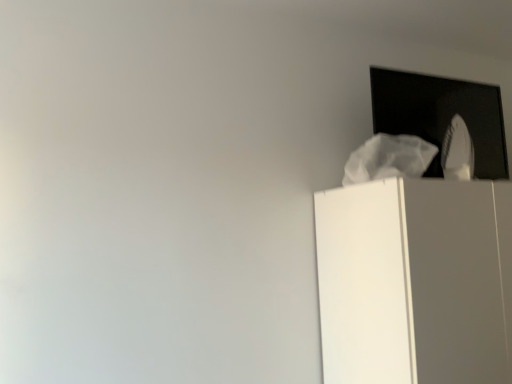
Question: Could you tell me if black glass window at upper right is turned towards white matte cabinet at upper right?

Choices:
 (A) no
 (B) yes

Answer: (A)

Question: Is black glass window at upper right smaller than white matte cabinet at upper right?

Choices:
 (A) yes
 (B) no

Answer: (A)

Question: Does black glass window at upper right have a lesser height compared to white matte cabinet at upper right?

Choices:
 (A) no
 (B) yes

Answer: (B)

Question: Is black glass window at upper right taller than white matte cabinet at upper right?

Choices:
 (A) no
 (B) yes

Answer: (A)

Question: Are black glass window at upper right and white matte cabinet at upper right beside each other?

Choices:
 (A) no
 (B) yes

Answer: (A)

Question: Can you confirm if black glass window at upper right is thinner than white matte cabinet at upper right?

Choices:
 (A) no
 (B) yes

Answer: (B)

Question: Considering the relative sizes of white matte cabinet at upper right and black glass window at upper right in the image provided, is white matte cabinet at upper right wider than black glass window at upper right?

Choices:
 (A) yes
 (B) no

Answer: (A)

Question: Can you confirm if white matte cabinet at upper right is smaller than black glass window at upper right?

Choices:
 (A) no
 (B) yes

Answer: (A)

Question: Is white matte cabinet at upper right thinner than black glass window at upper right?

Choices:
 (A) no
 (B) yes

Answer: (A)

Question: Is black glass window at upper right located within white matte cabinet at upper right?

Choices:
 (A) yes
 (B) no

Answer: (B)

Question: Is white matte cabinet at upper right at the left side of black glass window at upper right?

Choices:
 (A) no
 (B) yes

Answer: (A)

Question: From the image's perspective, is white matte cabinet at upper right located beneath black glass window at upper right?

Choices:
 (A) yes
 (B) no

Answer: (A)

Question: In terms of width, does white matte cabinet at upper right look wider or thinner when compared to black glass window at upper right?

Choices:
 (A) thin
 (B) wide

Answer: (B)